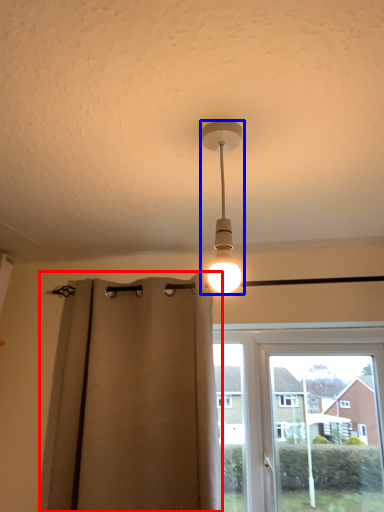
Question: Which object appears closest to the camera in this image, curtain (highlighted by a red box) or lamp (highlighted by a blue box)?

Choices:
 (A) curtain
 (B) lamp

Answer: (B)